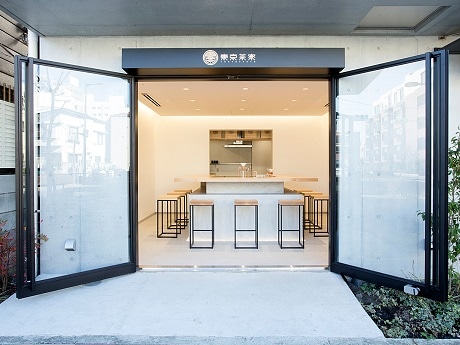
This screenshot has height=345, width=460. Identify the location of work top. (245, 178).